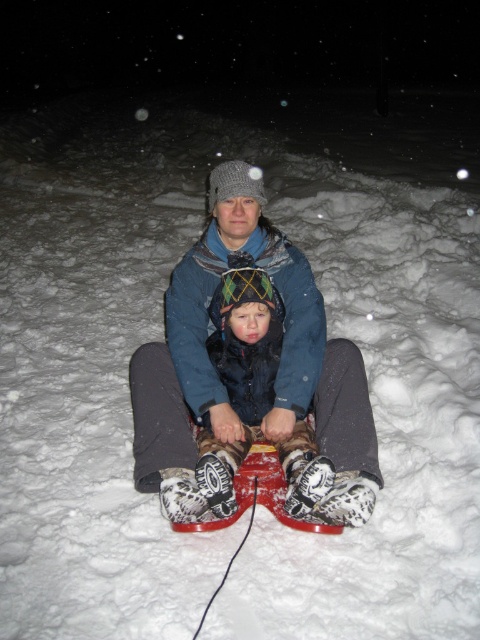
Can you confirm if matte blue jacket at center is positioned to the right of plush woolen hat at center?

Incorrect, matte blue jacket at center is not on the right side of plush woolen hat at center.

Can you confirm if matte blue jacket at center is taller than plush woolen hat at center?

Indeed, matte blue jacket at center has a greater height compared to plush woolen hat at center.

Is point (214, 301) closer to camera compared to point (215, 474)?

No, it is behind (215, 474).

Locate an element on the screen. The width and height of the screenshot is (480, 640). matte blue jacket at center is located at coordinates (250, 374).